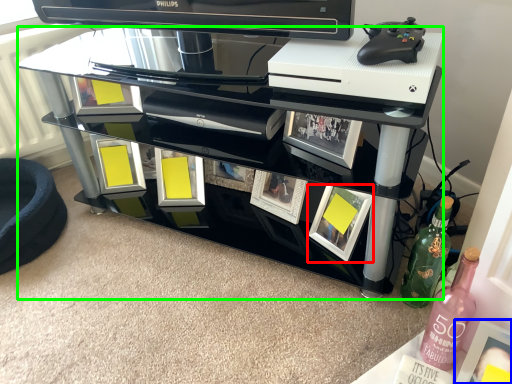
Question: Estimate the real-world distances between objects in this image. Which object is farther from picture frame (highlighted by a red box), picture frame (highlighted by a blue box) or table (highlighted by a green box)?

Choices:
 (A) picture frame
 (B) table

Answer: (A)